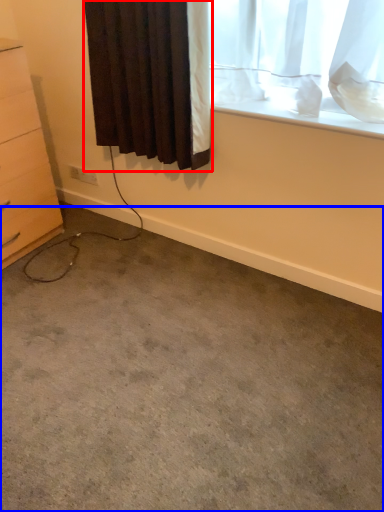
Question: Among these objects, which one is nearest to the camera, curtain (highlighted by a red box) or concrete (highlighted by a blue box)?

Choices:
 (A) curtain
 (B) concrete

Answer: (B)